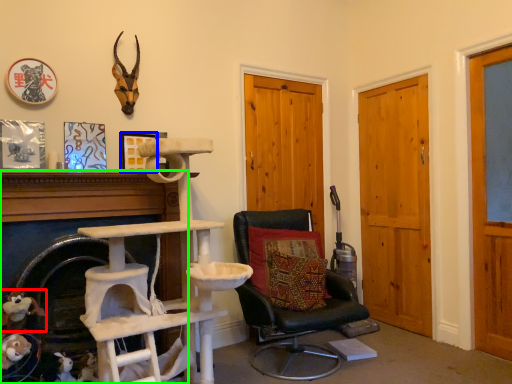
Question: Which object is positioned closest to toy (highlighted by a red box)? Select from picture frame (highlighted by a blue box) and fireplace (highlighted by a green box).

Choices:
 (A) picture frame
 (B) fireplace

Answer: (B)